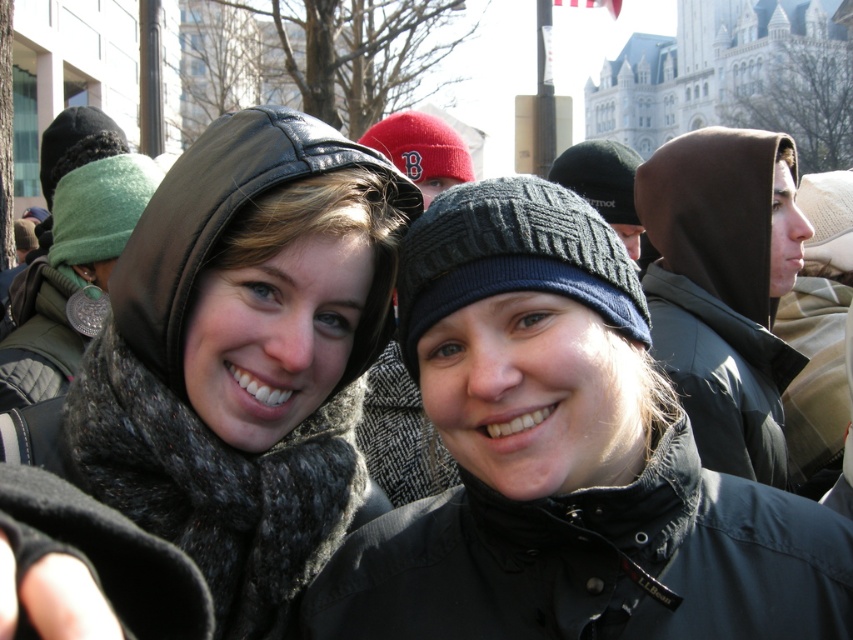
Who is taller, matte black hood at center or brown matte hood at right?

With more height is matte black hood at center.

How much distance is there between matte black hood at center and brown matte hood at right?

matte black hood at center and brown matte hood at right are 24.41 meters apart from each other.

Between point (339, 515) and point (769, 436), which one is positioned behind?

Positioned behind is point (769, 436).

The width and height of the screenshot is (853, 640). In order to click on matte black hood at center in this screenshot , I will do `click(244, 356)`.

The width and height of the screenshot is (853, 640). What do you see at coordinates (564, 460) in the screenshot?
I see `black knit hat at center` at bounding box center [564, 460].

Is point (462, 586) farther from camera compared to point (698, 388)?

No, it is in front of (698, 388).

At what (x,y) coordinates should I click in order to perform the action: click on black knit hat at center. Please return your answer as a coordinate pair (x, y). Looking at the image, I should click on (564, 460).

How far apart are black knit hat at center and matte black hood at center?

black knit hat at center is 8.97 meters from matte black hood at center.

Between point (520, 428) and point (231, 544), which one is positioned in front?

Positioned in front is point (231, 544).

Where is `black knit hat at center`? This screenshot has width=853, height=640. black knit hat at center is located at coordinates (564, 460).